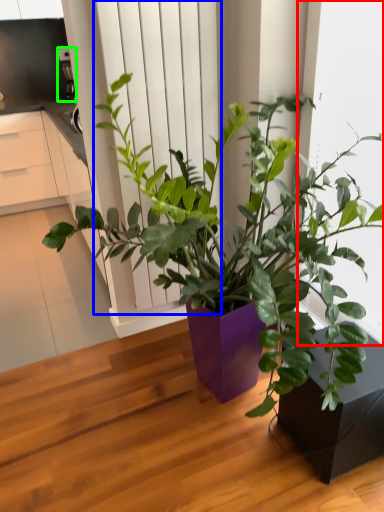
Question: Considering the real-world distances, which object is farthest from window frame (highlighted by a red box)? screen door (highlighted by a blue box) or appliance (highlighted by a green box)?

Choices:
 (A) screen door
 (B) appliance

Answer: (B)